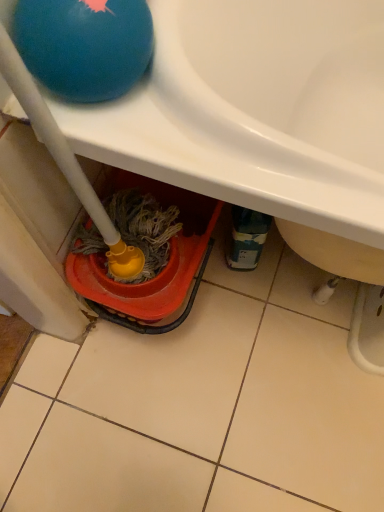
Measure the distance between point [120,72] and camera.

16.50 inches.

Describe the element at coordinates (84, 45) in the screenshot. I see `blue rubber ball at upper left` at that location.

Locate an element on the screen. This screenshot has width=384, height=512. blue rubber ball at upper left is located at coordinates (84, 45).

You are a GUI agent. You are given a task and a screenshot of the screen. Output one action in this format:
    pyautogui.click(x=<x>, y=<y>)
    Task: Click on the white glossy sink at upper center
    
    Given the screenshot: What is the action you would take?
    pyautogui.click(x=256, y=110)

This screenshot has height=512, width=384. What do you see at coordinates (256, 110) in the screenshot? I see `white glossy sink at upper center` at bounding box center [256, 110].

Where is `blue rubber ball at upper left`? The height and width of the screenshot is (512, 384). blue rubber ball at upper left is located at coordinates (84, 45).

Which is more to the left, blue rubber ball at upper left or white glossy sink at upper center?

From the viewer's perspective, blue rubber ball at upper left appears more on the left side.

Which object is closer to the camera, blue rubber ball at upper left or white glossy sink at upper center?

white glossy sink at upper center is closer to the camera.

Which point is more forward, (93, 56) or (274, 167)?

Positioned in front is point (93, 56).

From the image's perspective, is blue rubber ball at upper left located above white glossy sink at upper center?

No, from the image's perspective, blue rubber ball at upper left is not over white glossy sink at upper center.

From a real-world perspective, between blue rubber ball at upper left and white glossy sink at upper center, who is vertically higher?

blue rubber ball at upper left, from a real-world perspective.

From the picture: Which object is thinner, blue rubber ball at upper left or white glossy sink at upper center?

Thinner between the two is blue rubber ball at upper left.

In terms of height, does blue rubber ball at upper left look taller or shorter compared to white glossy sink at upper center?

Clearly, blue rubber ball at upper left is shorter compared to white glossy sink at upper center.

In the scene shown: Between blue rubber ball at upper left and white glossy sink at upper center, which one has larger size?

white glossy sink at upper center is bigger.

Would you say blue rubber ball at upper left is outside white glossy sink at upper center?

No, blue rubber ball at upper left is not outside of white glossy sink at upper center.

Is blue rubber ball at upper left not close to white glossy sink at upper center?

blue rubber ball at upper left is actually quite close to white glossy sink at upper center.

Does blue rubber ball at upper left turn towards white glossy sink at upper center?

No, blue rubber ball at upper left is not turned towards white glossy sink at upper center.

Locate an element on the screen. The width and height of the screenshot is (384, 512). sink that is on the right side of blue rubber ball at upper left is located at coordinates (256, 110).

Which is more to the left, white glossy sink at upper center or blue rubber ball at upper left?

blue rubber ball at upper left.

In the scene shown: Is white glossy sink at upper center further to the viewer compared to blue rubber ball at upper left?

No, white glossy sink at upper center is in front of blue rubber ball at upper left.

Does point (214, 142) come farther from viewer compared to point (76, 50)?

Yes.

From the image's perspective, is white glossy sink at upper center under blue rubber ball at upper left?

Incorrect, from the image's perspective, white glossy sink at upper center is higher than blue rubber ball at upper left.

From a real-world perspective, between white glossy sink at upper center and blue rubber ball at upper left, who is vertically higher?

blue rubber ball at upper left, from a real-world perspective.

Which of these two, white glossy sink at upper center or blue rubber ball at upper left, is thinner?

With smaller width is blue rubber ball at upper left.

Does white glossy sink at upper center have a greater height compared to blue rubber ball at upper left?

Indeed, white glossy sink at upper center has a greater height compared to blue rubber ball at upper left.

Does white glossy sink at upper center have a smaller size compared to blue rubber ball at upper left?

No, white glossy sink at upper center is not smaller than blue rubber ball at upper left.

Is blue rubber ball at upper left completely or partially inside white glossy sink at upper center?

Yes, blue rubber ball at upper left is a part of white glossy sink at upper center.

Are white glossy sink at upper center and blue rubber ball at upper left beside each other?

No, white glossy sink at upper center is not in contact with blue rubber ball at upper left.

Does white glossy sink at upper center turn towards blue rubber ball at upper left?

No, white glossy sink at upper center is not turned towards blue rubber ball at upper left.

Locate an element on the screen. The height and width of the screenshot is (512, 384). ball behind the white glossy sink at upper center is located at coordinates (84, 45).

At what (x,y) coordinates should I click in order to perform the action: click on ball below the white glossy sink at upper center (from the image's perspective). Please return your answer as a coordinate pair (x, y). The height and width of the screenshot is (512, 384). Looking at the image, I should click on point(84,45).

Find the location of a particular element. The width and height of the screenshot is (384, 512). sink located on the right of blue rubber ball at upper left is located at coordinates coord(256,110).